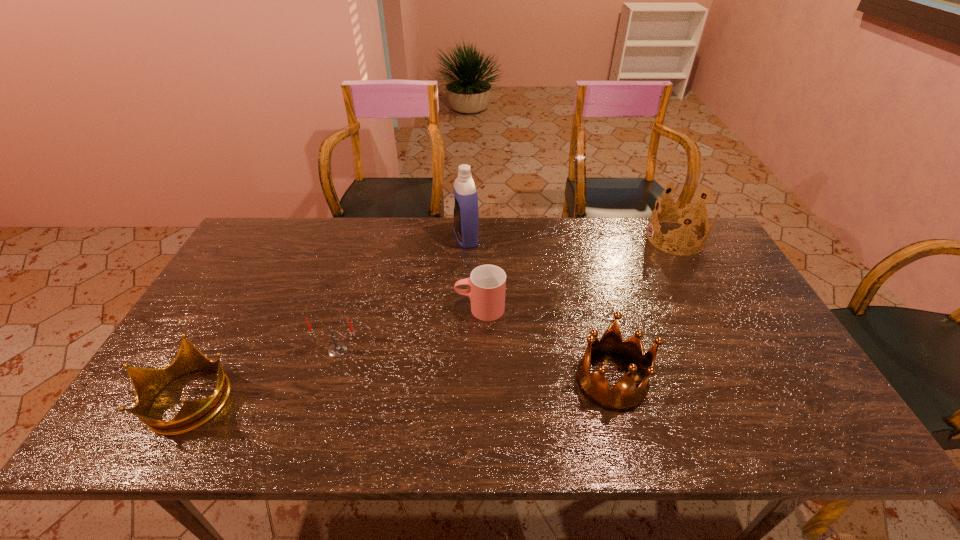
The height and width of the screenshot is (540, 960). I want to click on vacant point located on the back of the second crown from right to left, so click(x=600, y=338).

Image resolution: width=960 pixels, height=540 pixels. I want to click on vacant space located on the side of the third farthest object with the handle, so click(349, 308).

Image resolution: width=960 pixels, height=540 pixels. What are the coordinates of `vacant space located 0.370m on the side of the third farthest object with the handle` in the screenshot? It's located at (324, 308).

Locate an element on the screen. The height and width of the screenshot is (540, 960). free space located on the side of the third farthest object with the handle is located at coordinates (335, 308).

You are a GUI agent. You are given a task and a screenshot of the screen. Output one action in this format:
    pyautogui.click(x=<x>, y=<y>)
    Task: Click on the vacant space located on the front-facing side of the fifth object from right to left
    
    Given the screenshot: What is the action you would take?
    pyautogui.click(x=319, y=414)

At what (x,y) coordinates should I click in order to perform the action: click on free location located on the right of the shortest crown. Please return your answer as a coordinate pair (x, y). This screenshot has height=540, width=960. Looking at the image, I should click on (316, 398).

Locate an element on the screen. This screenshot has width=960, height=540. detergent that is positioned at the far edge is located at coordinates (466, 217).

The height and width of the screenshot is (540, 960). Identify the location of crown present at the far edge. (684, 213).

I want to click on object located at the left edge, so click(147, 383).

Identify the location of object present at the right edge. (684, 213).